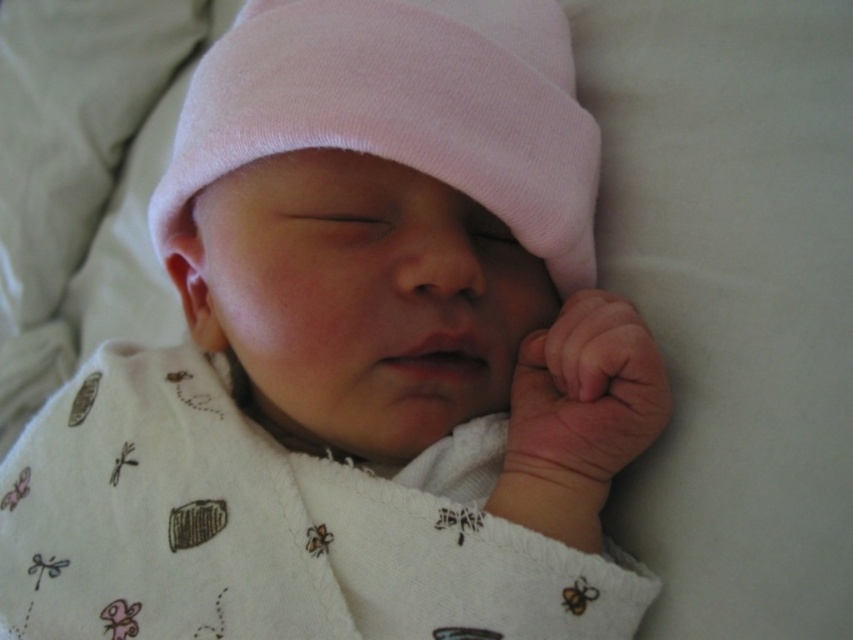
Which of these two, pink cotton hat at center or smooth skin hand at lower right, stands shorter?

smooth skin hand at lower right

Does pink cotton hat at center appear on the left side of smooth skin hand at lower right?

Indeed, pink cotton hat at center is positioned on the left side of smooth skin hand at lower right.

Does point (245, 120) lie behind point (611, 429)?

Yes, it is.

In order to click on pink cotton hat at center in this screenshot , I will do `click(403, 109)`.